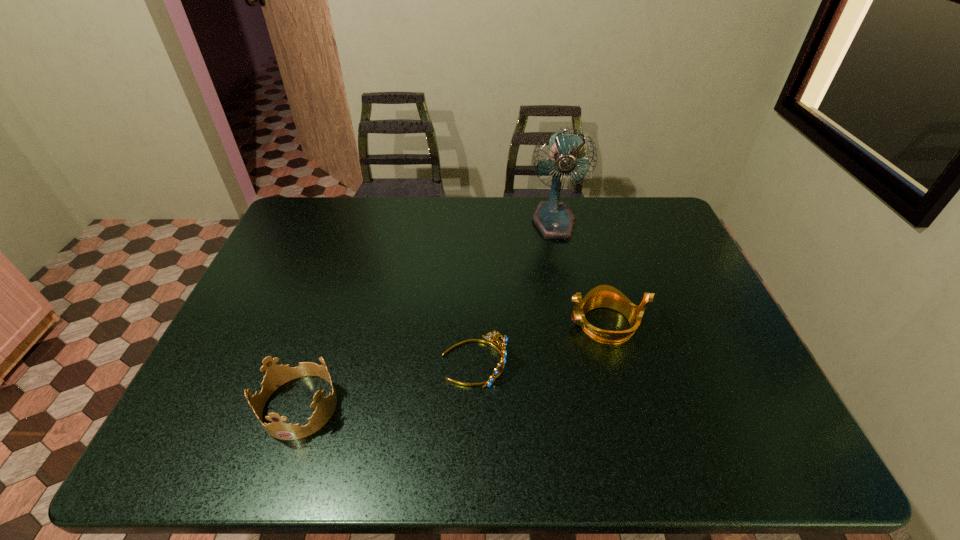
At what (x,y) coordinates should I click in order to perform the action: click on free space between the third object from right to left and the leftmost object. Please return your answer as a coordinate pair (x, y). Image resolution: width=960 pixels, height=540 pixels. Looking at the image, I should click on (387, 383).

I want to click on free spot between the second object from left to right and the fan, so click(x=514, y=292).

In order to click on empty space that is in between the farthest object and the leftmost tiara in this screenshot , I will do `click(427, 314)`.

At what (x,y) coordinates should I click in order to perform the action: click on free space between the third object from right to left and the tallest object. Please return your answer as a coordinate pair (x, y). Looking at the image, I should click on (514, 292).

You are a GUI agent. You are given a task and a screenshot of the screen. Output one action in this format:
    pyautogui.click(x=<x>, y=<y>)
    Task: Click on the free space between the farthest object and the third object from right to left
    
    Given the screenshot: What is the action you would take?
    pyautogui.click(x=514, y=292)

Identify the location of free spot between the leftmost object and the rightmost tiara. The width and height of the screenshot is (960, 540). (452, 365).

Find the location of a particular element. vacant space in between the leftmost object and the second tiara from left to right is located at coordinates (387, 383).

The width and height of the screenshot is (960, 540). Identify the location of object that is the closest to the leftmost tiara. (501, 346).

This screenshot has height=540, width=960. In order to click on object that ranks as the second closest to the tallest object in this screenshot , I will do `click(501, 346)`.

Identify which tiara is located as the nearest to the rightmost tiara. Please provide its 2D coordinates. Your answer should be formatted as a tuple, i.e. [(x, y)], where the tuple contains the x and y coordinates of a point satisfying the conditions above.

[(501, 346)]